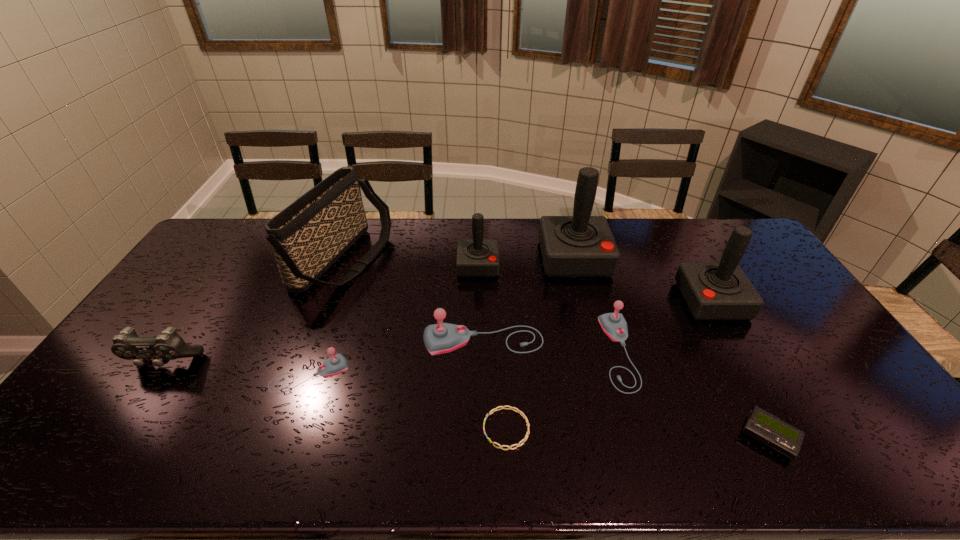
Find the location of a particular element. This screenshot has width=960, height=540. the second red joystick from left to right is located at coordinates (581, 245).

Image resolution: width=960 pixels, height=540 pixels. In order to click on the tallest object in this screenshot , I will do `click(581, 245)`.

I want to click on the rightmost joystick, so click(x=720, y=290).

The height and width of the screenshot is (540, 960). Identify the location of the second biggest red joystick. (720, 290).

Locate an element on the screen. Image resolution: width=960 pixels, height=540 pixels. handbag is located at coordinates (307, 237).

Find the location of a particular element. Image resolution: width=960 pixels, height=540 pixels. the smallest red joystick is located at coordinates (477, 257).

Where is `the leftmost red joystick`? Image resolution: width=960 pixels, height=540 pixels. the leftmost red joystick is located at coordinates (477, 257).

You are a GUI agent. You are given a task and a screenshot of the screen. Output one action in this format:
    pyautogui.click(x=<x>, y=<y>)
    Task: Click on the biggest gray joystick
    The height and width of the screenshot is (540, 960).
    Given the screenshot: What is the action you would take?
    pyautogui.click(x=439, y=338)

At what (x,y) coordinates should I click in order to perform the action: click on the third shortest joystick. Please return your answer as a coordinate pair (x, y). This screenshot has width=960, height=540. Looking at the image, I should click on (439, 338).

The image size is (960, 540). Identify the location of the leftmost object. (127, 345).